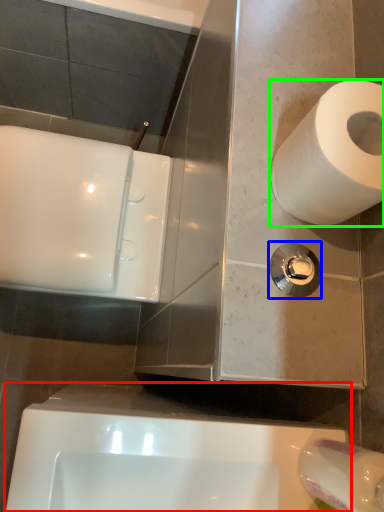
Question: Which is farther away from bath (highlighted by a red box)? plumbing fixture (highlighted by a blue box) or toilet paper (highlighted by a green box)?

Choices:
 (A) plumbing fixture
 (B) toilet paper

Answer: (B)